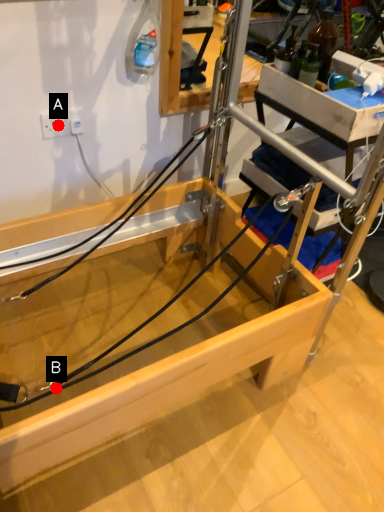
Question: Two points are circled on the image, labeled by A and B beside each circle. Which of the following is the closest to the observer?

Choices:
 (A) A is closer
 (B) B is closer

Answer: (B)